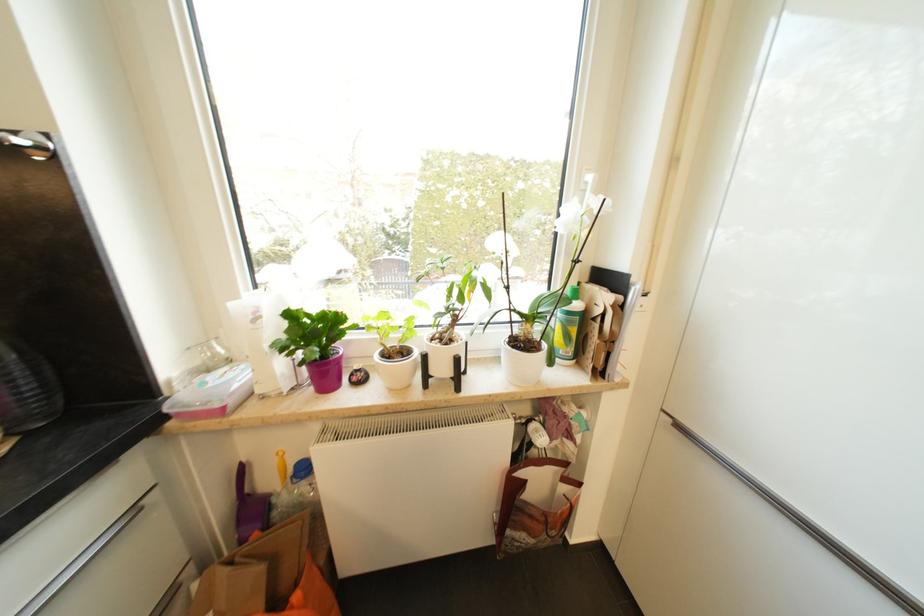
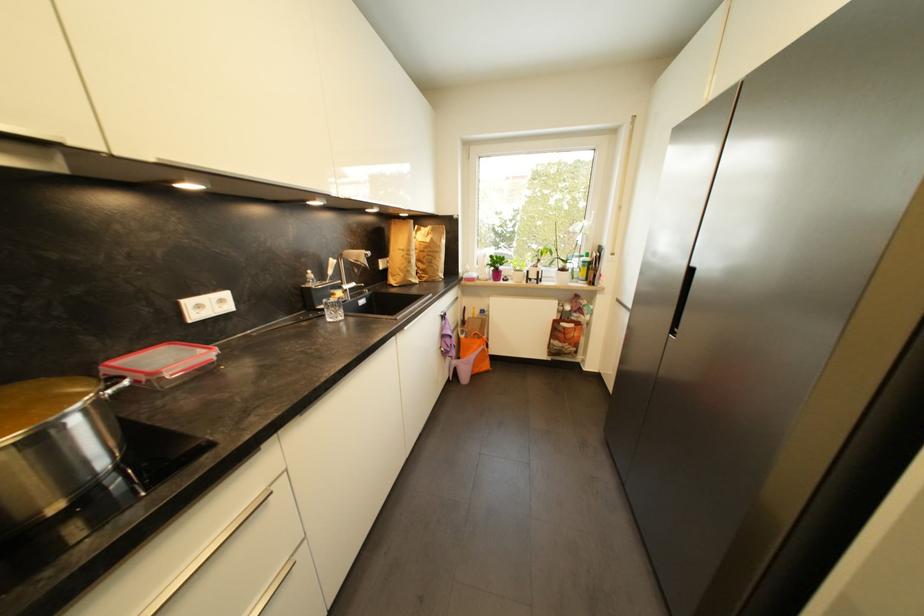
Find the pixel in the second image that matches point 295,317 in the first image.

(495, 257)